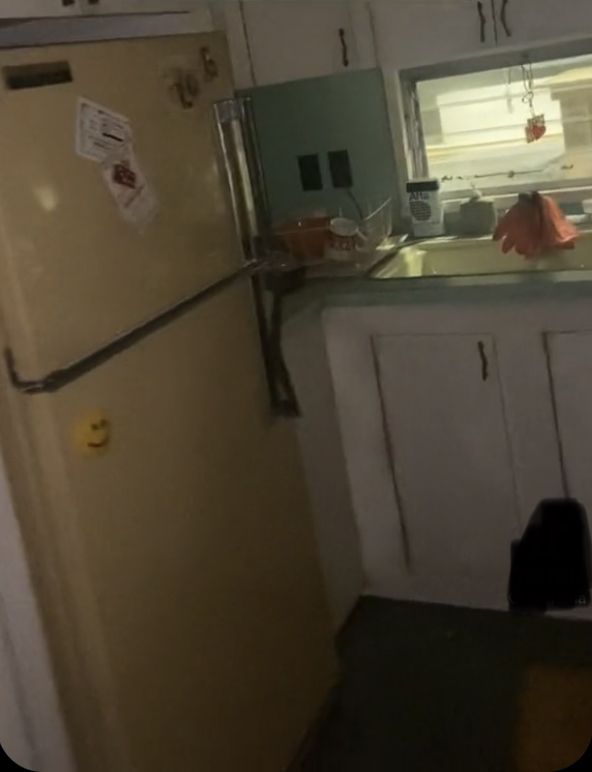
Image resolution: width=592 pixels, height=772 pixels. I want to click on wall, so click(x=329, y=491).